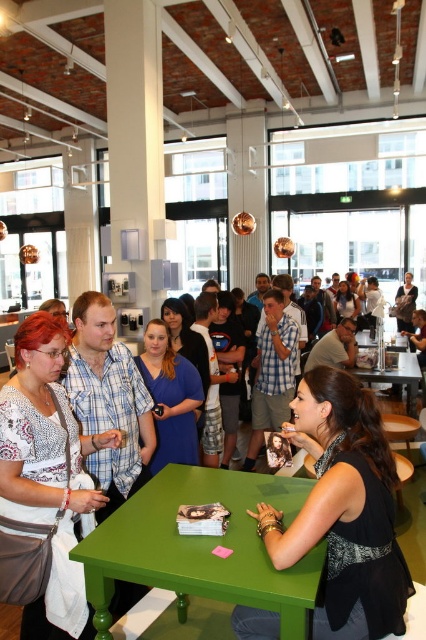
Question: Which object appears farthest from the camera in this image?

Choices:
 (A) matte white shirt at center
 (B) green painted wood table at center

Answer: (A)

Question: Which of these objects is positioned closest to the green painted wood table at center?

Choices:
 (A) black matte dress at lower right
 (B) green matte table at center
 (C) matte white shirt at center

Answer: (A)

Question: Where is black matte dress at lower right located in relation to green matte table at center in the image?

Choices:
 (A) right
 (B) left

Answer: (B)

Question: Does green painted wood table at center have a smaller size compared to green matte table at center?

Choices:
 (A) no
 (B) yes

Answer: (B)

Question: Which point appears farthest from the camera in this image?

Choices:
 (A) (385, 378)
 (B) (108, 429)
 (C) (328, 416)
 (D) (236, 577)

Answer: (A)

Question: Considering the relative positions of black matte dress at lower right and green matte table at center in the image provided, where is black matte dress at lower right located with respect to green matte table at center?

Choices:
 (A) left
 (B) right

Answer: (A)